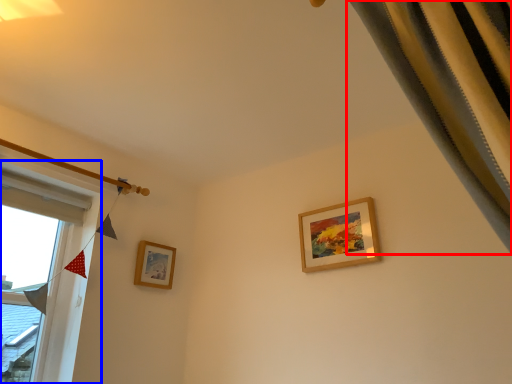
Question: Which point is further to the camera, curtain (highlighted by a red box) or window (highlighted by a blue box)?

Choices:
 (A) curtain
 (B) window

Answer: (B)